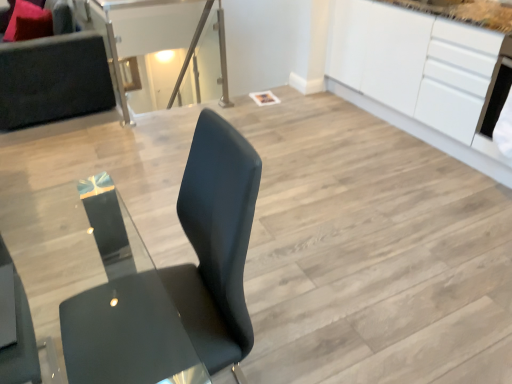
Question: From a real-world perspective, is matte black chair at lower left, the second chair positioned from the bottom, on transparent glass table at upper center?

Choices:
 (A) no
 (B) yes

Answer: (B)

Question: Is matte black chair at lower left, the first chair in the top-to-bottom sequence, bigger than transparent glass table at upper center?

Choices:
 (A) yes
 (B) no

Answer: (B)

Question: Does matte black chair at lower left, the first chair in the top-to-bottom sequence, have a greater height compared to transparent glass table at upper center?

Choices:
 (A) no
 (B) yes

Answer: (A)

Question: From the image's perspective, would you say matte black chair at lower left, the second chair positioned from the bottom, is shown under transparent glass table at upper center?

Choices:
 (A) yes
 (B) no

Answer: (A)

Question: Can you confirm if matte black chair at lower left, the first chair in the top-to-bottom sequence, is smaller than transparent glass table at upper center?

Choices:
 (A) yes
 (B) no

Answer: (A)

Question: Is matte black chair at lower left, the first chair in the top-to-bottom sequence, to the right of transparent glass table at upper center from the viewer's perspective?

Choices:
 (A) no
 (B) yes

Answer: (B)

Question: Considering the relative sizes of matte black chair at center, marked as the 2th chair in a top-to-bottom arrangement, and velvet pink pillow at upper left in the image provided, is matte black chair at center, marked as the 2th chair in a top-to-bottom arrangement, shorter than velvet pink pillow at upper left?

Choices:
 (A) yes
 (B) no

Answer: (B)

Question: Is matte black chair at center, marked as the 2th chair in a top-to-bottom arrangement, closer to the viewer compared to velvet pink pillow at upper left?

Choices:
 (A) yes
 (B) no

Answer: (A)

Question: Does matte black chair at center, the 1th chair in the bottom-to-top sequence, appear on the right side of velvet pink pillow at upper left?

Choices:
 (A) no
 (B) yes

Answer: (B)

Question: From the image's perspective, does matte black chair at center, marked as the 2th chair in a top-to-bottom arrangement, appear lower than velvet pink pillow at upper left?

Choices:
 (A) yes
 (B) no

Answer: (A)

Question: Is matte black chair at center, marked as the 2th chair in a top-to-bottom arrangement, beside velvet pink pillow at upper left?

Choices:
 (A) yes
 (B) no

Answer: (B)

Question: Is velvet pink pillow at upper left a part of matte black chair at center, the 1th chair in the bottom-to-top sequence?

Choices:
 (A) no
 (B) yes

Answer: (A)

Question: From the image's perspective, is white glossy cabinetry at upper right under matte black chair at lower left, the second chair positioned from the bottom?

Choices:
 (A) yes
 (B) no

Answer: (B)